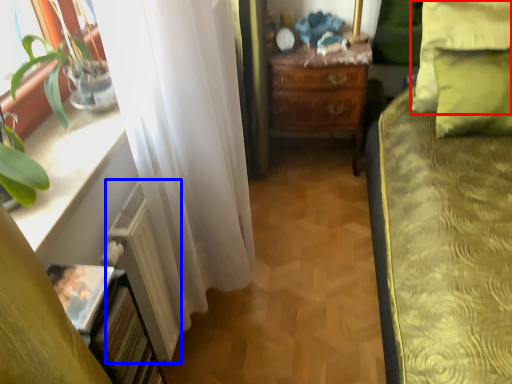
Question: Among these objects, which one is nearest to the camera, pillow (highlighted by a red box) or radiator (highlighted by a blue box)?

Choices:
 (A) pillow
 (B) radiator

Answer: (B)